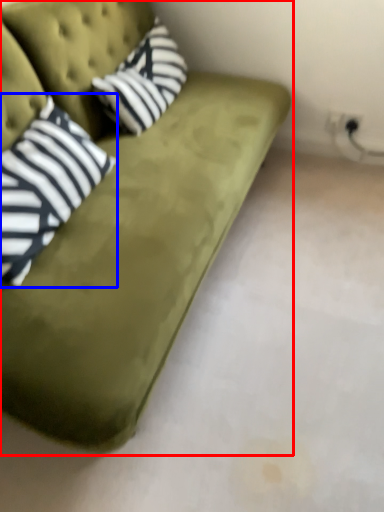
Question: Which point is further to the camera, studio couch (highlighted by a red box) or pillow (highlighted by a blue box)?

Choices:
 (A) studio couch
 (B) pillow

Answer: (B)